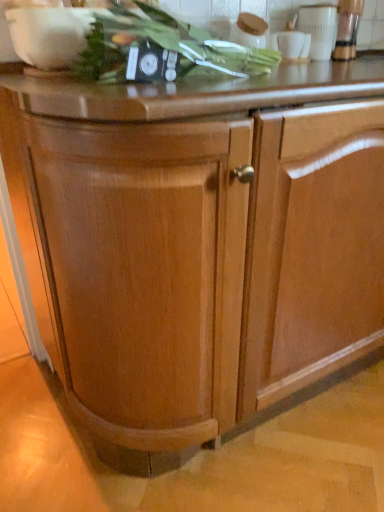
Question: Can you confirm if green leafy vegetable at upper center is wider than metallic silver blender at upper right, arranged as the first appliance when viewed from the right?

Choices:
 (A) yes
 (B) no

Answer: (A)

Question: Does green leafy vegetable at upper center have a larger size compared to metallic silver blender at upper right, arranged as the first appliance when viewed from the right?

Choices:
 (A) no
 (B) yes

Answer: (B)

Question: From a real-world perspective, is green leafy vegetable at upper center located beneath metallic silver blender at upper right, arranged as the first appliance when viewed from the right?

Choices:
 (A) no
 (B) yes

Answer: (B)

Question: Does green leafy vegetable at upper center have a lesser height compared to metallic silver blender at upper right, arranged as the first appliance when viewed from the right?

Choices:
 (A) no
 (B) yes

Answer: (B)

Question: Is green leafy vegetable at upper center thinner than metallic silver blender at upper right, the second appliance in the left-to-right sequence?

Choices:
 (A) yes
 (B) no

Answer: (B)

Question: Is white glossy cup at upper right, which is the 1th appliance from left to right, spatially inside metallic silver blender at upper right, the second appliance in the left-to-right sequence, or outside of it?

Choices:
 (A) inside
 (B) outside

Answer: (B)

Question: Considering the relative positions of white glossy cup at upper right, which is the 1th appliance from left to right, and metallic silver blender at upper right, arranged as the first appliance when viewed from the right, in the image provided, is white glossy cup at upper right, which is the 1th appliance from left to right, to the left or to the right of metallic silver blender at upper right, arranged as the first appliance when viewed from the right,?

Choices:
 (A) left
 (B) right

Answer: (A)

Question: Considering the positions of white glossy cup at upper right, which is counted as the 2th appliance, starting from the right, and metallic silver blender at upper right, arranged as the first appliance when viewed from the right, in the image, is white glossy cup at upper right, which is counted as the 2th appliance, starting from the right, taller or shorter than metallic silver blender at upper right, arranged as the first appliance when viewed from the right,?

Choices:
 (A) short
 (B) tall

Answer: (A)

Question: Considering the positions of point 306,19 and point 350,34, is point 306,19 closer or farther from the camera than point 350,34?

Choices:
 (A) farther
 (B) closer

Answer: (B)

Question: Is white glossy cup at upper right, which is counted as the 2th appliance, starting from the right, wider or thinner than green leafy vegetable at upper center?

Choices:
 (A) wide
 (B) thin

Answer: (B)

Question: From the image's perspective, is white glossy cup at upper right, which is the 1th appliance from left to right, located above or below green leafy vegetable at upper center?

Choices:
 (A) above
 (B) below

Answer: (A)

Question: Considering the relative positions of white glossy cup at upper right, which is counted as the 2th appliance, starting from the right, and green leafy vegetable at upper center in the image provided, is white glossy cup at upper right, which is counted as the 2th appliance, starting from the right, to the left or to the right of green leafy vegetable at upper center?

Choices:
 (A) right
 (B) left

Answer: (A)

Question: Is white glossy cup at upper right, which is the 1th appliance from left to right, inside or outside of green leafy vegetable at upper center?

Choices:
 (A) outside
 (B) inside

Answer: (A)

Question: Is point (344, 52) closer or farther from the camera than point (144, 50)?

Choices:
 (A) closer
 (B) farther

Answer: (B)

Question: Choose the correct answer: Is metallic silver blender at upper right, arranged as the first appliance when viewed from the right, inside green leafy vegetable at upper center or outside it?

Choices:
 (A) outside
 (B) inside

Answer: (A)